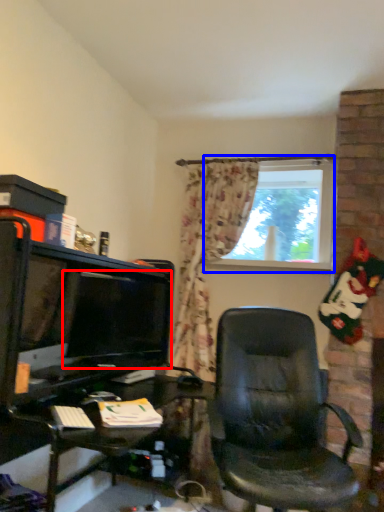
Question: Which object appears closest to the camera in this image, computer monitor (highlighted by a red box) or window (highlighted by a blue box)?

Choices:
 (A) computer monitor
 (B) window

Answer: (A)